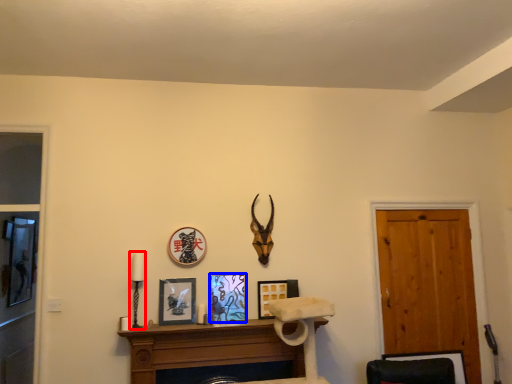
Question: Which object appears farthest to the camera in this image, candle holder (highlighted by a red box) or picture frame (highlighted by a blue box)?

Choices:
 (A) candle holder
 (B) picture frame

Answer: (B)